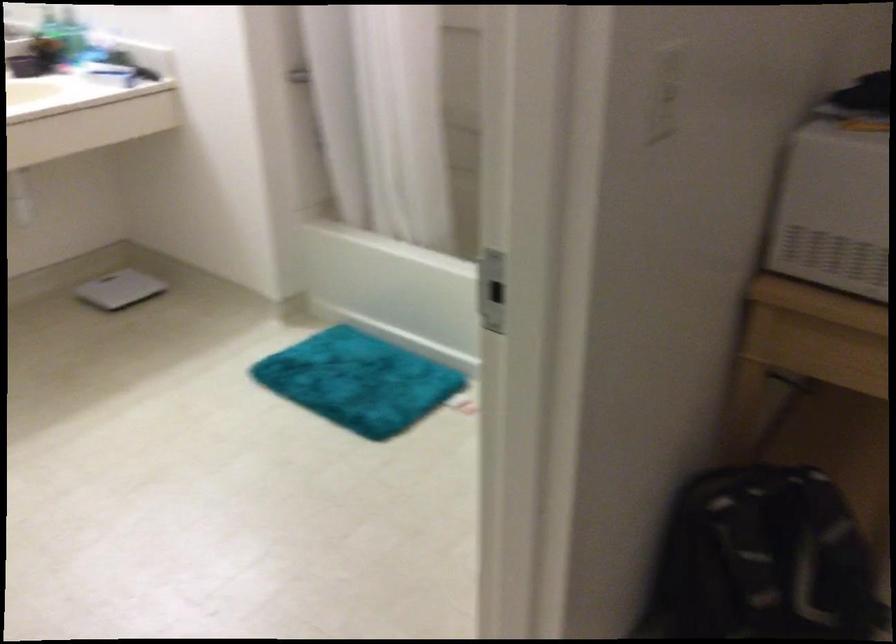
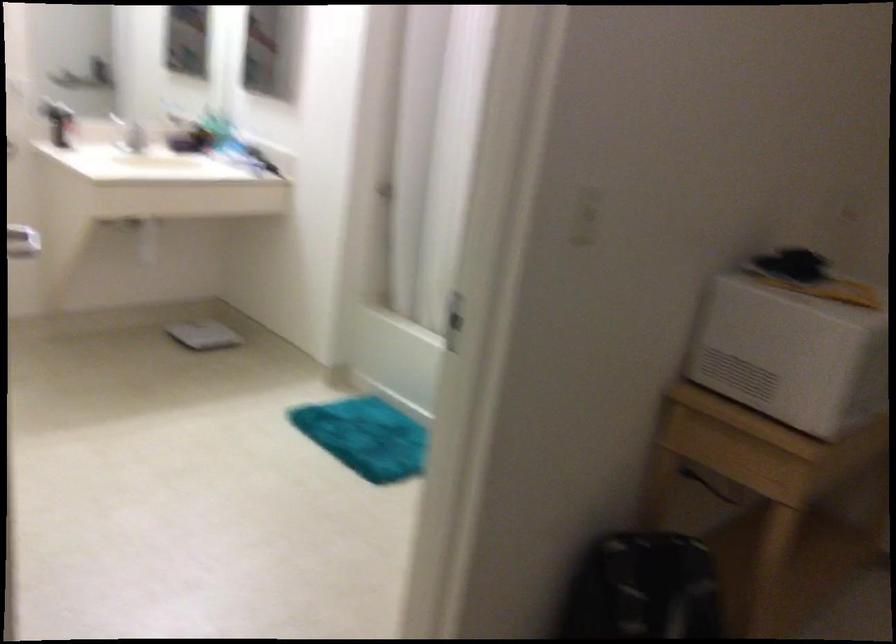
The images are taken continuously from a first-person perspective. In which direction are you moving?

The cameraman moved toward right, backward.